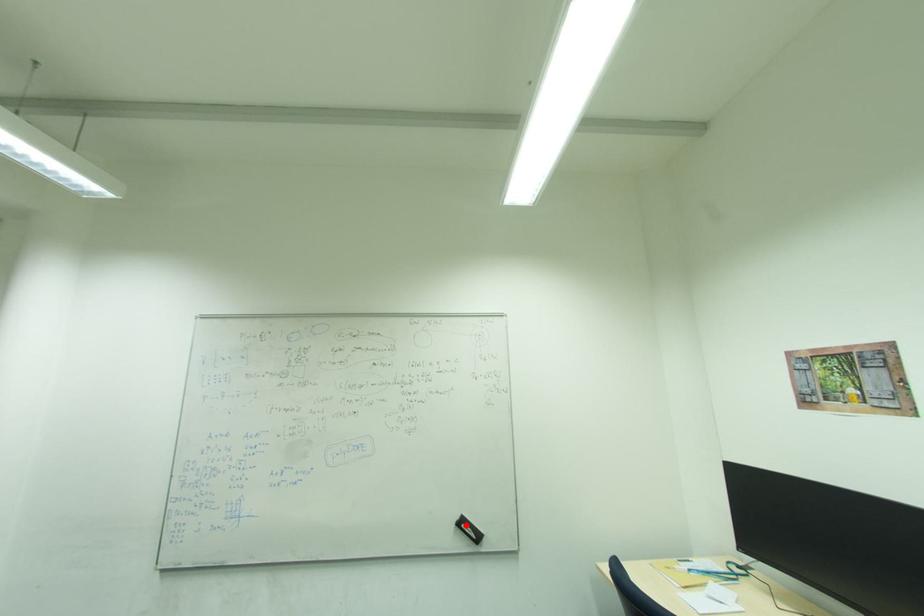
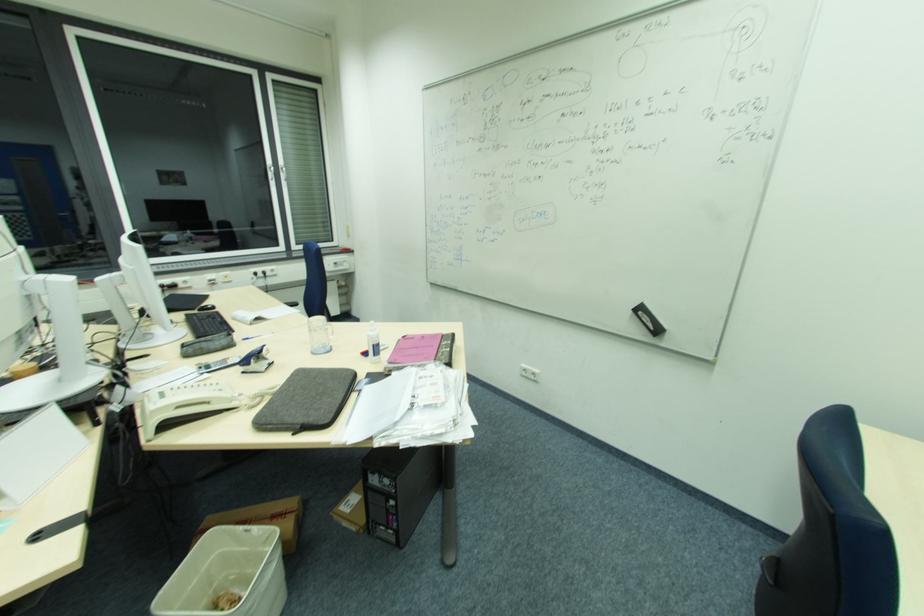
The point at the highlighted location is marked in the first image. Where is the corresponding point in the second image?

(643, 314)